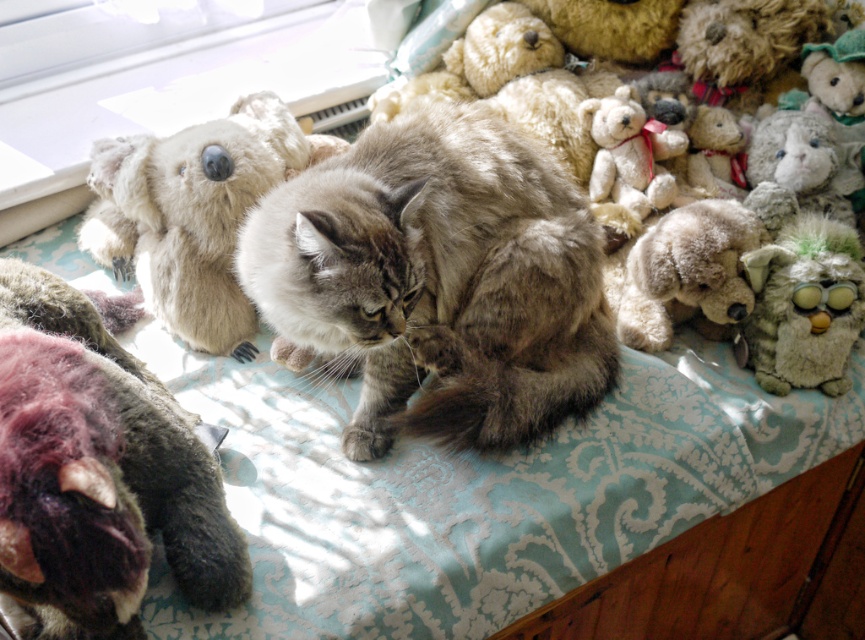
Is green fuzzy owl at right closer to camera compared to fluffy beige stuffed dog at right?

No, it is behind fluffy beige stuffed dog at right.

Does green fuzzy owl at right have a smaller size compared to fluffy beige stuffed dog at right?

Indeed, green fuzzy owl at right has a smaller size compared to fluffy beige stuffed dog at right.

Describe the element at coordinates (804, 305) in the screenshot. I see `green fuzzy owl at right` at that location.

Locate an element on the screen. green fuzzy owl at right is located at coordinates (804, 305).

Does point (459, 420) come behind point (654, 172)?

No, it is in front of (654, 172).

What do you see at coordinates (439, 280) in the screenshot? This screenshot has height=640, width=865. I see `fuzzy gray cat at center` at bounding box center [439, 280].

Which is behind, point (591, 385) or point (639, 184)?

Point (639, 184)

Image resolution: width=865 pixels, height=640 pixels. In order to click on fuzzy gray cat at center in this screenshot , I will do `click(439, 280)`.

How far apart are fuzzy gray bear at lower left and fluffy beige teddy bear at upper right?

fuzzy gray bear at lower left is 97.63 centimeters away from fluffy beige teddy bear at upper right.

Is fuzzy gray bear at lower left further to the viewer compared to fluffy beige teddy bear at upper right?

No, it is not.

Which is in front, point (235, 524) or point (776, 180)?

Point (235, 524)

Locate an element on the screen. The image size is (865, 640). fuzzy gray bear at lower left is located at coordinates (97, 470).